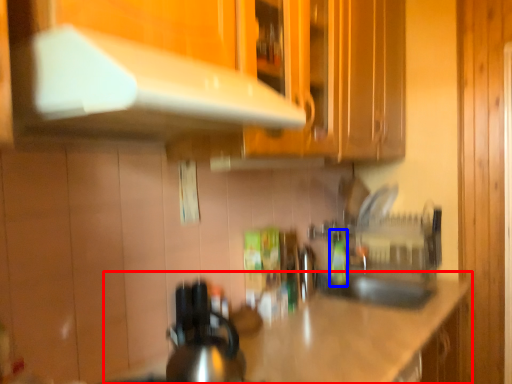
Question: Which point is closer to the camera, countertop (highlighted by a red box) or bottle (highlighted by a blue box)?

Choices:
 (A) countertop
 (B) bottle

Answer: (A)